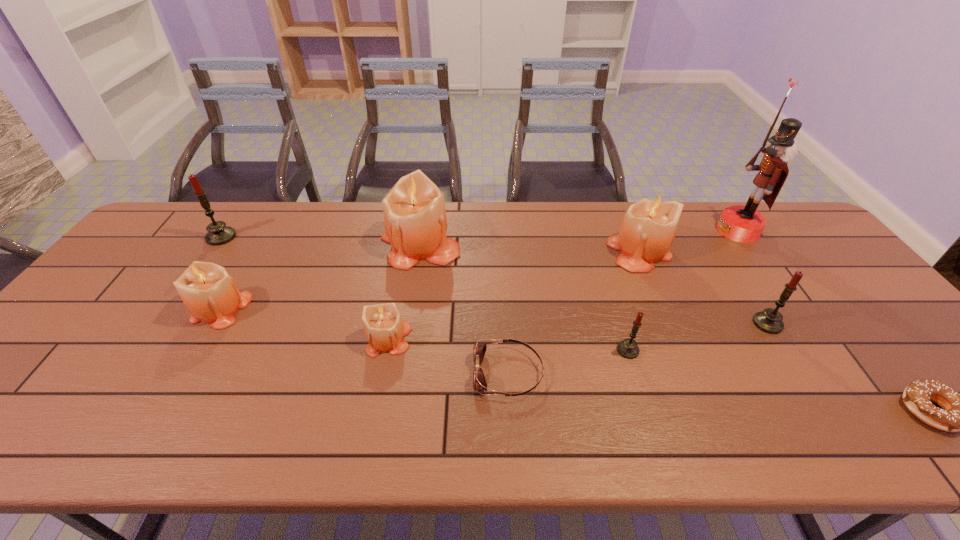
Find the location of a particular element. free space that satisfies the following two spatial constraints: 1. on the front side of the smallest beige candle; 2. on the left side of the farthest red candle is located at coordinates (151, 339).